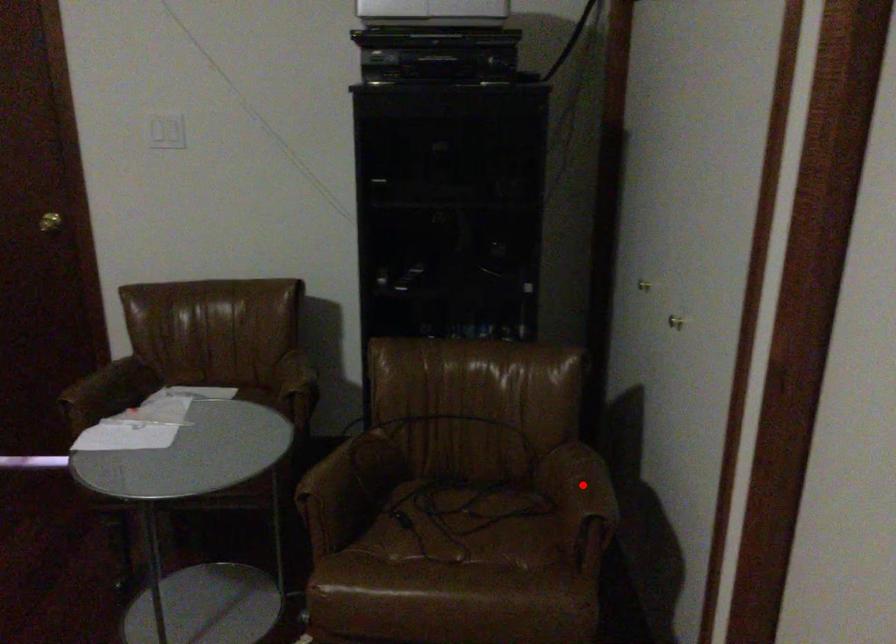
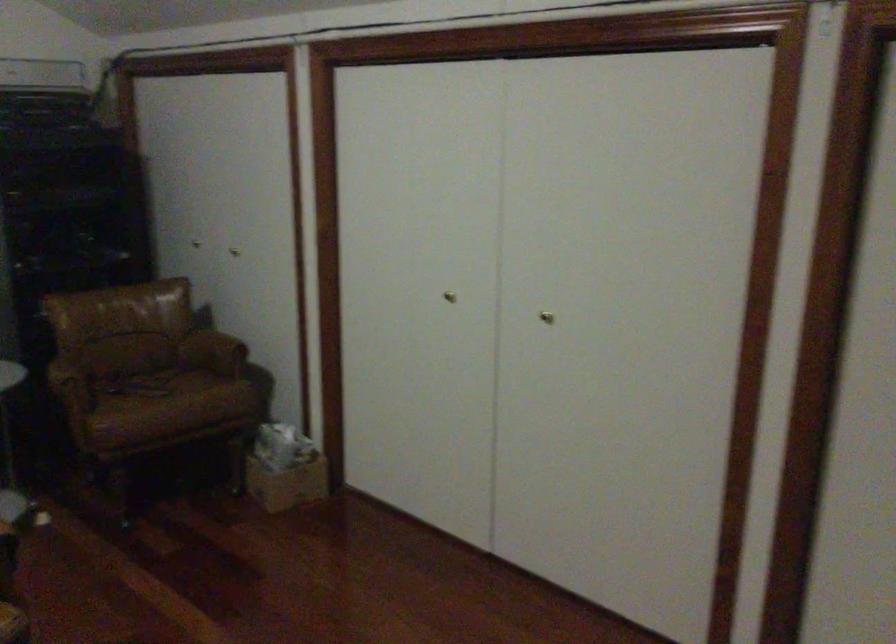
Question: I am providing you with two images of the same scene from different viewpoints. A red point is marked on the first image. At the location where the point appears in image 1, is it still visible in image 2?

Choices:
 (A) Yes
 (B) No

Answer: (A)